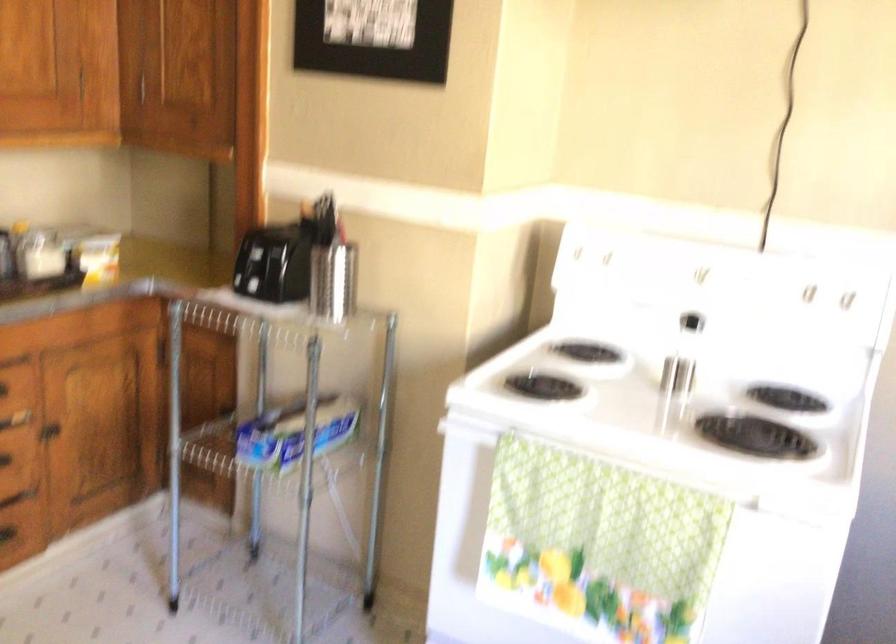
This screenshot has height=644, width=896. In order to click on metal utensil holder in this screenshot , I will do `click(333, 281)`.